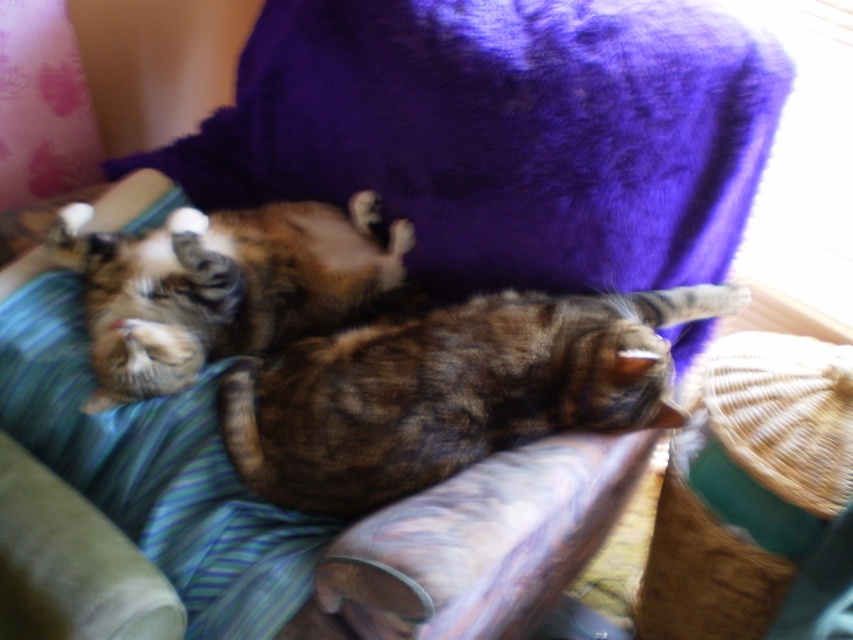
You are a cat owner who wants to ensure both cats have enough space to sleep comfortably. Given the scene, which cat is smaller in height between the brown fur cat at center and the tabby fur cat at center?

The brown fur cat at center is not as tall as the tabby fur cat at center, so the brown fur cat at center is smaller in height.

You are a photographer trying to capture a photo of both the brown fur cat at center and the tabby fur cat at center. From the current angle, which cat is positioned more to the left?

The tabby fur cat at center is positioned more to the left since the brown fur cat at center is to the right of it.

You are a cat owner who wants to ensure both cats have enough space to sleep comfortably. Given that the bed is 1 meter wide, can both the brown fur cat at center and the tabby fur cat at center fit side by side without overlapping?

The brown fur cat at center is wider than the tabby fur cat at center. However, since the bed is 1 meter wide, both cats can fit side by side as long as their combined widths do not exceed the bed width. Unfortunately, without knowing their exact widths, we cannot confirm if they will fit perfectly.